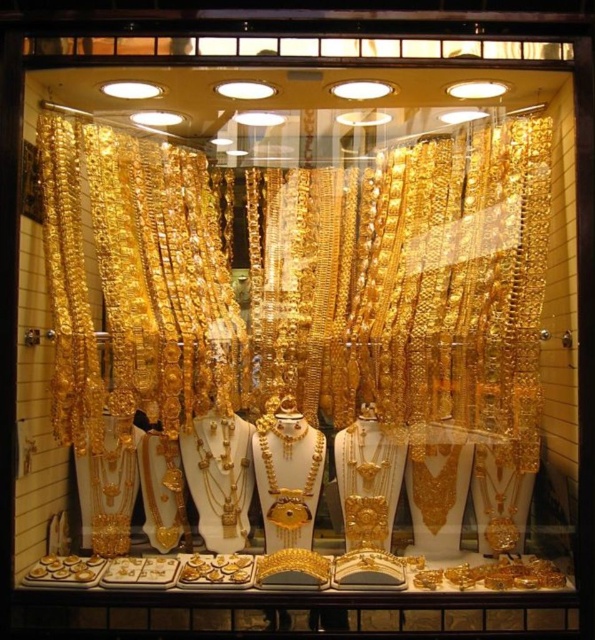
Question: Considering the relative positions of shiny gold jewelry at center and gold shiny necklace at center in the image provided, where is shiny gold jewelry at center located with respect to gold shiny necklace at center?

Choices:
 (A) above
 (B) below

Answer: (A)

Question: Which point is closer to the camera?

Choices:
 (A) shiny gold jewelry at center
 (B) gold shiny necklace at center

Answer: (A)

Question: Can you confirm if shiny gold jewelry at center is smaller than gold shiny necklace at center?

Choices:
 (A) yes
 (B) no

Answer: (B)

Question: Is shiny gold jewelry at center to the right of gold shiny necklace at center from the viewer's perspective?

Choices:
 (A) yes
 (B) no

Answer: (A)